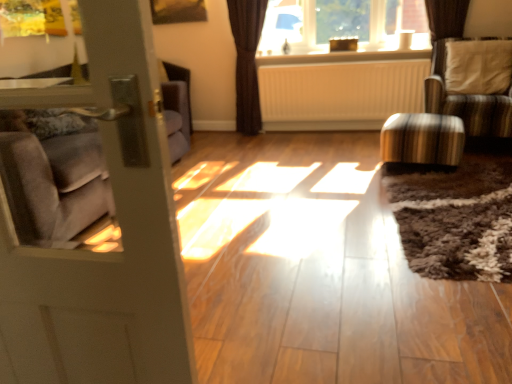
Where is `vacant region under brown textured curtain at upper center (from a real-world perspective)`? The image size is (512, 384). vacant region under brown textured curtain at upper center (from a real-world perspective) is located at coordinates (256, 133).